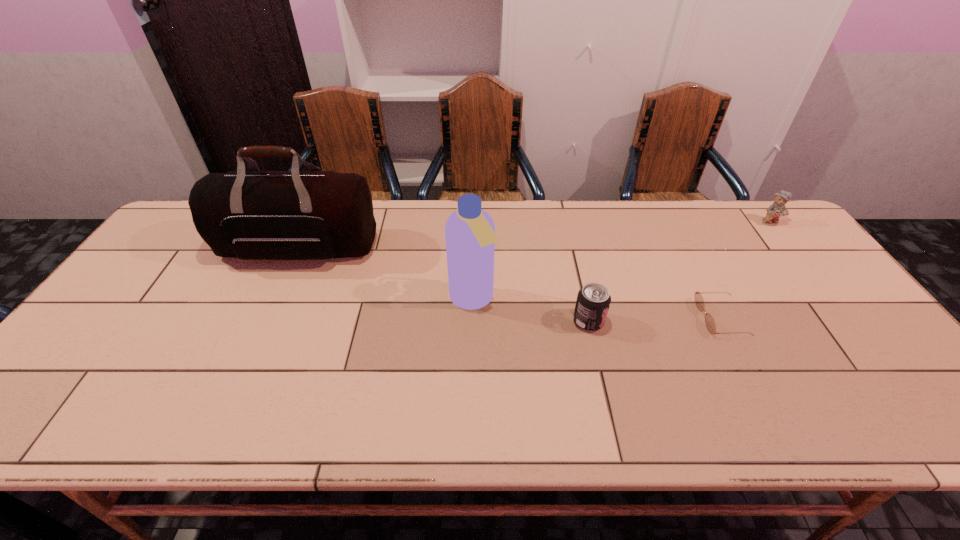
This screenshot has height=540, width=960. I want to click on vacant space at the right edge, so click(x=789, y=262).

In the image, there is a desktop. In order to click on vacant area at the near right corner in this screenshot , I will do `click(921, 426)`.

Identify the location of empty space between the duffel bag and the second object from left to right. (386, 274).

Locate an element on the screen. Image resolution: width=960 pixels, height=540 pixels. blank region between the duffel bag and the soda can is located at coordinates (444, 285).

The image size is (960, 540). In order to click on vacant area that lies between the soda can and the shortest object in this screenshot , I will do `click(655, 319)`.

You are a GUI agent. You are given a task and a screenshot of the screen. Output one action in this format:
    pyautogui.click(x=<x>, y=<y>)
    Task: Click on the free space between the second object from right to left and the third object from left to right
    
    Given the screenshot: What is the action you would take?
    pyautogui.click(x=655, y=319)

Where is `vacant area between the duffel bag and the fourth object from right to left`? This screenshot has height=540, width=960. vacant area between the duffel bag and the fourth object from right to left is located at coordinates (386, 274).

At what (x,y) coordinates should I click in order to perform the action: click on empty location between the sunglasses and the soda can. Please return your answer as a coordinate pair (x, y). The width and height of the screenshot is (960, 540). Looking at the image, I should click on point(655,319).

The height and width of the screenshot is (540, 960). I want to click on vacant space that is in between the duffel bag and the teddy bear, so click(x=535, y=235).

You are a GUI agent. You are given a task and a screenshot of the screen. Output one action in this format:
    pyautogui.click(x=<x>, y=<y>)
    Task: Click on the blank region between the fourth object from right to left and the rightmost object
    This screenshot has width=960, height=540.
    Given the screenshot: What is the action you would take?
    pyautogui.click(x=621, y=261)